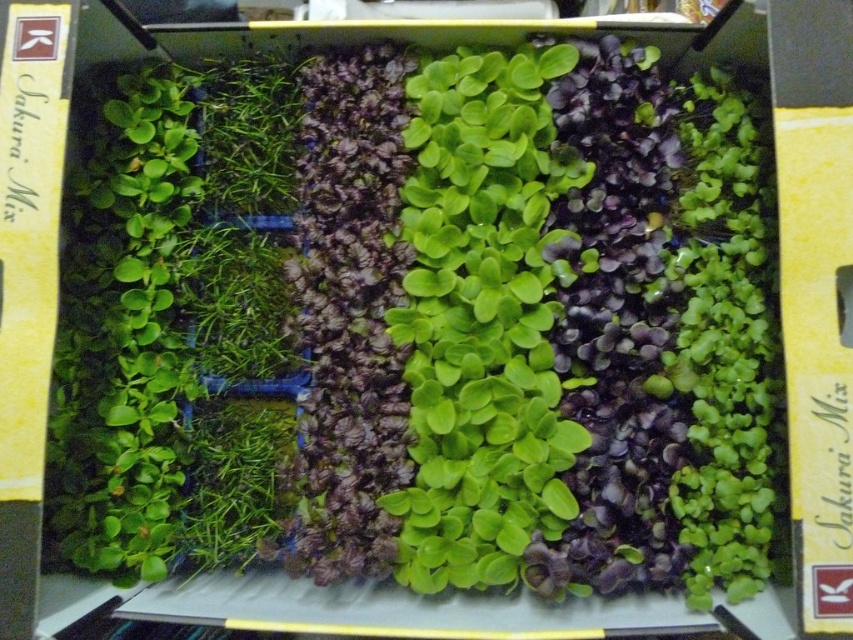
Based on the photo, you are a gardener who needs to water the plants in the seedling tray. You have a watering can with a 10 inch long spout. If you position the watering can over the green matte leafy plant at center, will the spout reach the green matte leafy plant at right without moving the can?

The green matte leafy plant at center is 8.69 inches away from the green matte leafy plant at right. Since the watering can spout is 10 inches long, it can reach the green matte leafy plant at right without moving the can.